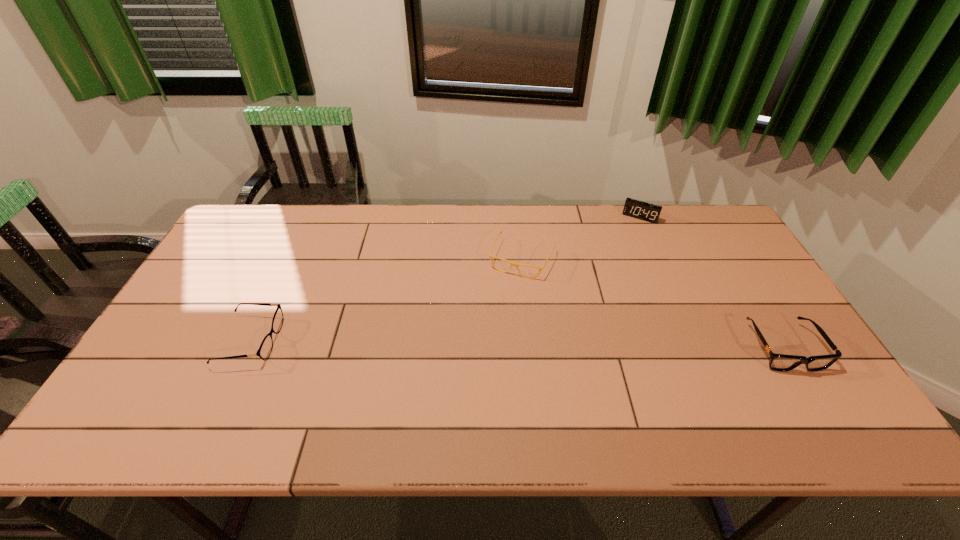
Find the location of a particular element. vacant space on the desktop that is between the left spectacles and the sunglasses and is positioned in front of the lenses of the third object from right to left is located at coordinates (484, 343).

Locate an element on the screen. This screenshot has height=540, width=960. vacant spot on the desktop that is between the leftmost object and the rightmost object and is positioned on the front-facing side of the farthest object is located at coordinates (581, 345).